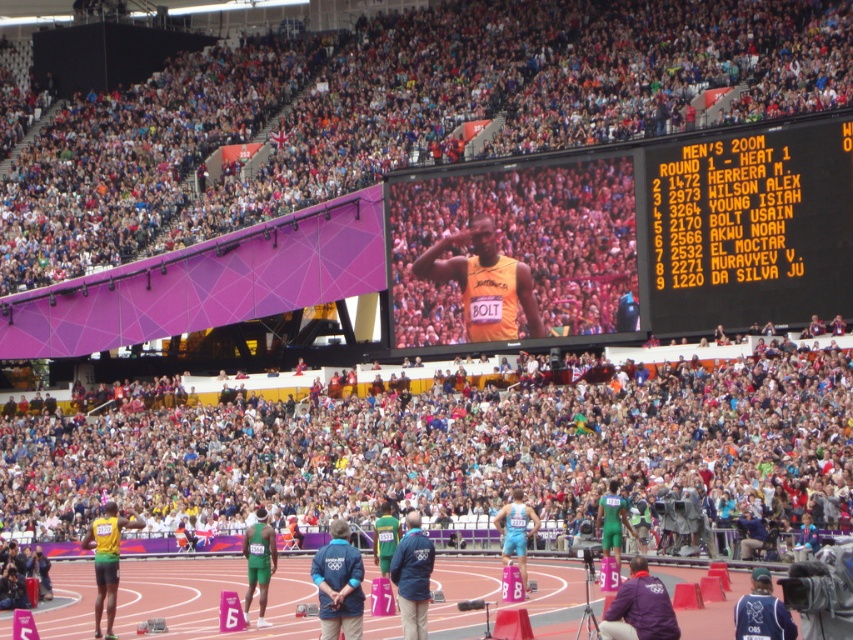
You are a photographer at the track and field event and want to capture a photo of both the orange matte shirt at center and the dark blue jersey at lower right. Based on their positions, which athlete is closer to the camera?

The orange matte shirt at center is positioned over the dark blue jersey at lower right, meaning it is closer to the camera.

You are a photographer positioned at the camera location. You want to capture a closeup shot of the point at coordinates (581,396). Given that your camera has a minimum focus distance of 50 meters, can you focus on this point?

The point at coordinates (581,396) is 80.27 meters away from the camera. Since the minimum focus distance of your camera is 50 meters, you can focus on this point because it is beyond the minimum required distance.

You are an athlete standing at the starting line of the track and field event. You want to wave to the crowd located at the center of the stadium. In which direction should you turn your head to face the white crowd at center?

You should turn your head to the center to face the white crowd at center located at point (445, 449).